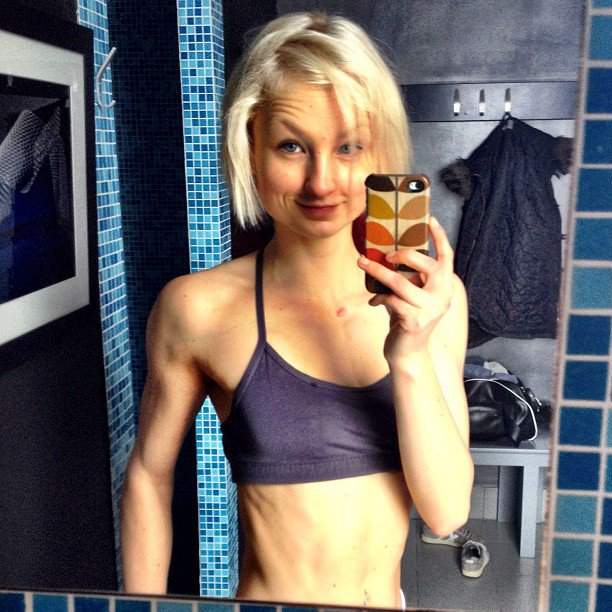
Find the location of a particular element. phone is located at coordinates (389, 225).